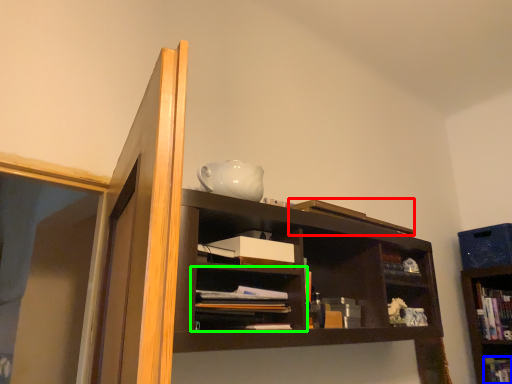
Question: Which is nearer to the book (highlighted by a red box)? book (highlighted by a blue box) or shelf (highlighted by a green box).

Choices:
 (A) book
 (B) shelf

Answer: (B)